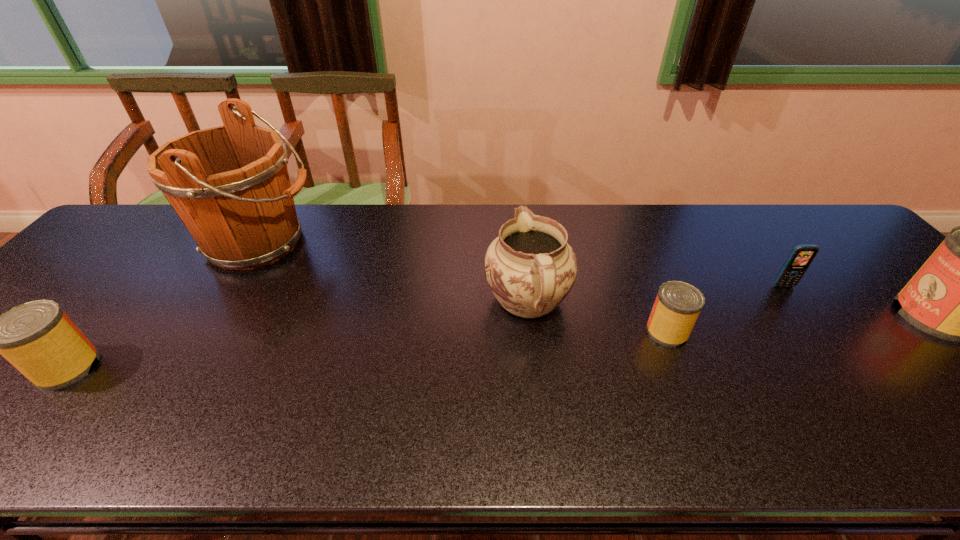
The image size is (960, 540). What are the coordinates of `the second shortest can` in the screenshot? It's located at (37, 337).

Where is `the leftmost can`? The height and width of the screenshot is (540, 960). the leftmost can is located at coordinates (37, 337).

Locate an element on the screen. The height and width of the screenshot is (540, 960). the shortest can is located at coordinates (678, 304).

Find the location of a particular element. the second can from left to right is located at coordinates (678, 304).

Locate an element on the screen. pitcher is located at coordinates (530, 267).

Find the location of `bucket`. bucket is located at coordinates (230, 186).

Locate an element on the screen. This screenshot has width=960, height=540. the second object from left to right is located at coordinates (230, 186).

This screenshot has width=960, height=540. I want to click on cellular telephone, so click(x=800, y=258).

At what (x,y) coordinates should I click in order to perform the action: click on free spot located on the back of the leftmost can. Please return your answer as a coordinate pair (x, y). Image resolution: width=960 pixels, height=540 pixels. Looking at the image, I should click on (138, 284).

You are a GUI agent. You are given a task and a screenshot of the screen. Output one action in this format:
    pyautogui.click(x=<x>, y=<y>)
    Task: Click on the free space located on the left of the third object from right to left
    This screenshot has width=960, height=540.
    Given the screenshot: What is the action you would take?
    pyautogui.click(x=612, y=332)